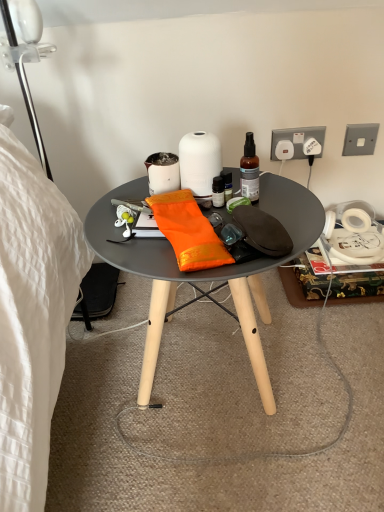
Identify the location of free point in front of white matte vase at center. (205, 220).